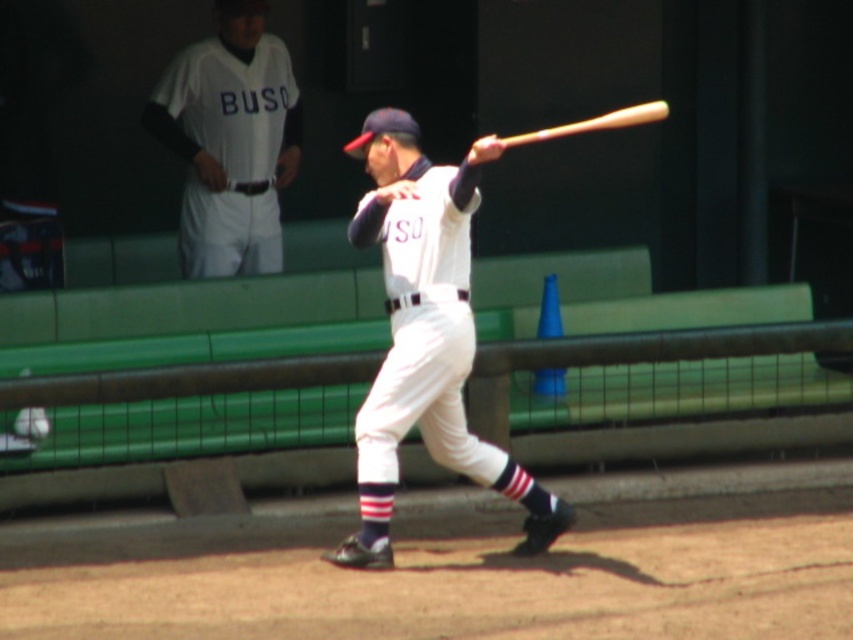
Between white matte baseball bat at center and wooden baseball bat at center, which one has more height?

Standing taller between the two is white matte baseball bat at center.

Is point (453, 330) positioned before point (639, 104)?

Yes, point (453, 330) is in front of point (639, 104).

You are a GUI agent. You are given a task and a screenshot of the screen. Output one action in this format:
    pyautogui.click(x=<x>, y=<y>)
    Task: Click on the white matte baseball bat at center
    The width and height of the screenshot is (853, 640).
    Given the screenshot: What is the action you would take?
    pyautogui.click(x=425, y=337)

Is white matte uniform at upper center above wooden baseball bat at center?

Indeed, white matte uniform at upper center is positioned over wooden baseball bat at center.

Which is behind, point (221, 177) or point (583, 124)?

The point (583, 124) is behind.

Is point (198, 141) closer to camera compared to point (637, 124)?

Yes.

Find the location of `white matte uniform at upper center`. white matte uniform at upper center is located at coordinates (230, 141).

Which is in front, point (402, 296) or point (224, 170)?

Point (402, 296)

Is white matte baseball bat at center shorter than white matte uniform at upper center?

Incorrect, white matte baseball bat at center's height does not fall short of white matte uniform at upper center's.

Does point (393, 362) come in front of point (212, 109)?

Yes, point (393, 362) is closer to viewer.

Find the location of a particular element. white matte baseball bat at center is located at coordinates (425, 337).